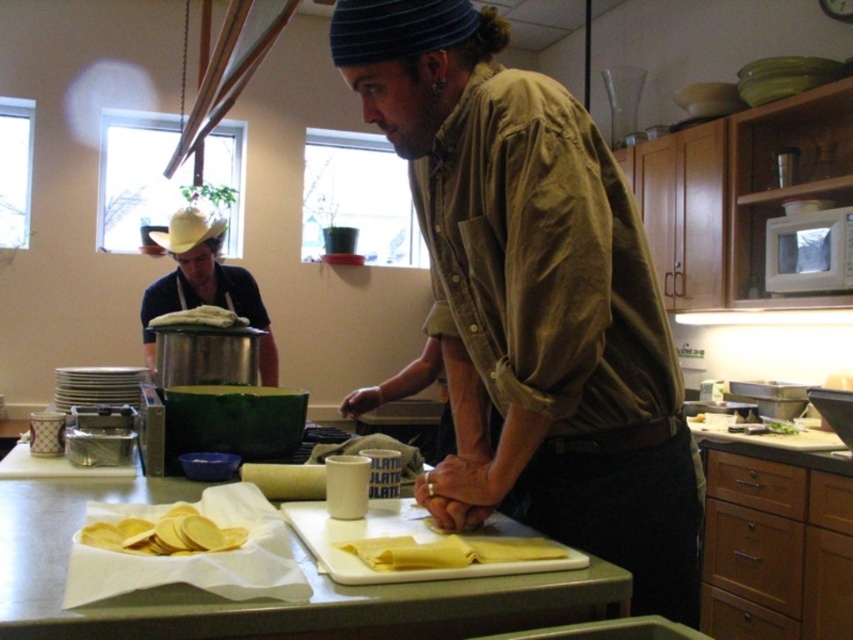
Can you confirm if brown corduroy shirt at center is bigger than matte silver pot at left?

Yes.

Which is in front, point (430, 214) or point (193, 240)?

Point (430, 214)

Is point (550, 109) behind point (177, 211)?

That is False.

Locate an element on the screen. brown corduroy shirt at center is located at coordinates (532, 298).

Does yellow matte chips at lower left have a lesser height compared to yellow straw cowboy hat at upper left?

Indeed, yellow matte chips at lower left has a lesser height compared to yellow straw cowboy hat at upper left.

Does yellow matte chips at lower left have a lesser width compared to yellow straw cowboy hat at upper left?

Yes.

This screenshot has width=853, height=640. What do you see at coordinates (163, 532) in the screenshot? I see `yellow matte chips at lower left` at bounding box center [163, 532].

The image size is (853, 640). I want to click on yellow matte chips at lower left, so click(x=163, y=532).

Looking at this image, which of these two, brown corduroy shirt at center or yellow straw cowboy hat at upper left, stands taller?

brown corduroy shirt at center

Is brown corduroy shirt at center further to camera compared to yellow straw cowboy hat at upper left?

No, brown corduroy shirt at center is in front of yellow straw cowboy hat at upper left.

Does point (647, 483) come behind point (198, 218)?

No.

Find the location of a particular element. Image resolution: width=853 pixels, height=640 pixels. brown corduroy shirt at center is located at coordinates (532, 298).